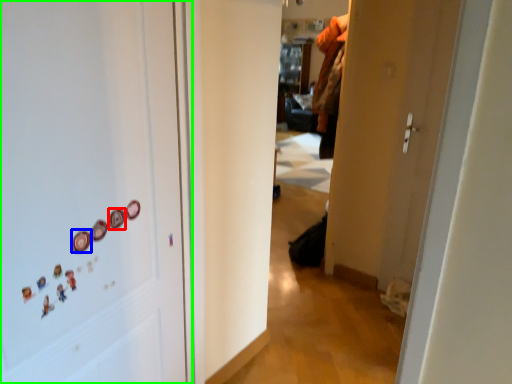
Question: Which object is positioned farthest from button (highlighted by a red box)? Select from button (highlighted by a blue box) and door (highlighted by a green box).

Choices:
 (A) button
 (B) door

Answer: (B)